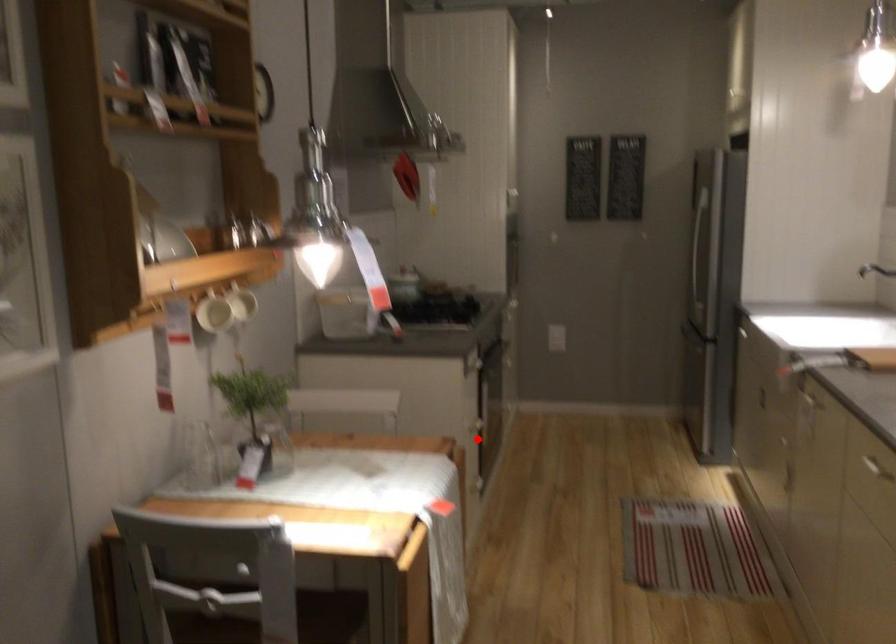
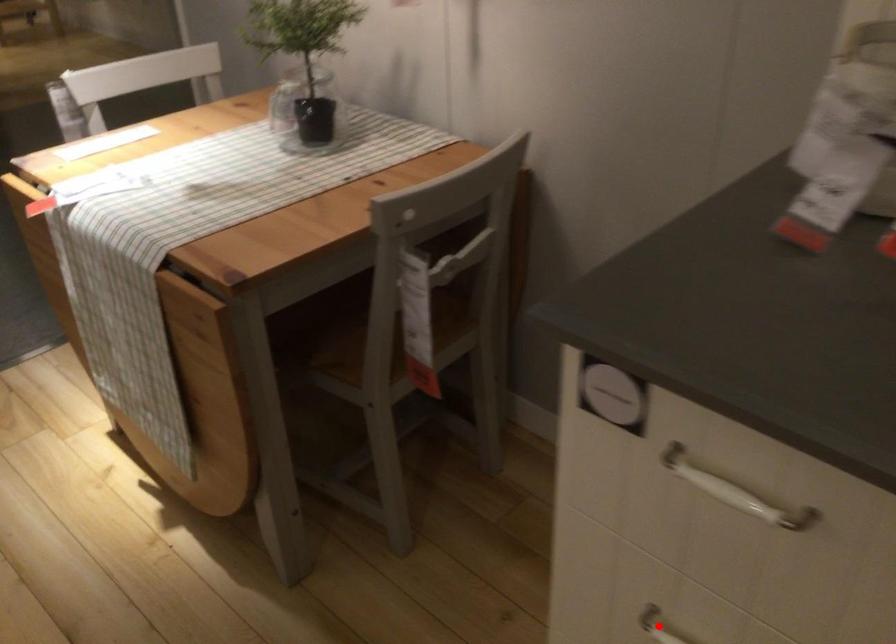
In the scene shown: I am providing you with two images of the same scene from different viewpoints. A red point is marked on the first image and another point is marked on the second image. Are the points marked in image1 and image2 representing the same 3D position?

Yes